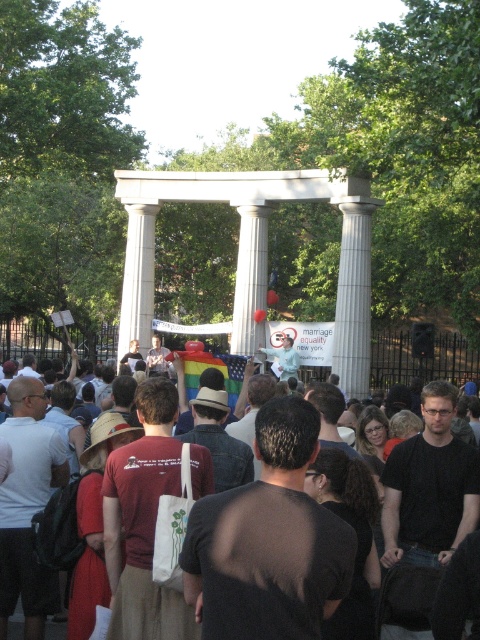
You are an architect designing a new public space and want to incorporate two similar structures. You observe the scene and notice the white marble column at center and the white marble pillar at center. Which one has a greater width according to the description?

The white marble column at center has a greater width than the white marble pillar at center.